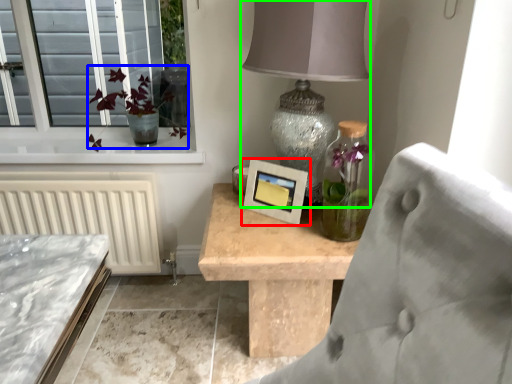
Question: Which is farther away from picture frame (highlighted by a red box)? floral arrangement (highlighted by a blue box) or table lamp (highlighted by a green box)?

Choices:
 (A) floral arrangement
 (B) table lamp

Answer: (A)